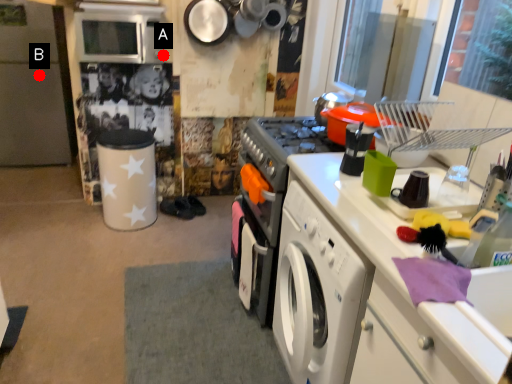
Question: Two points are circled on the image, labeled by A and B beside each circle. Among these points, which one is farthest from the camera?

Choices:
 (A) A is further
 (B) B is further

Answer: (B)